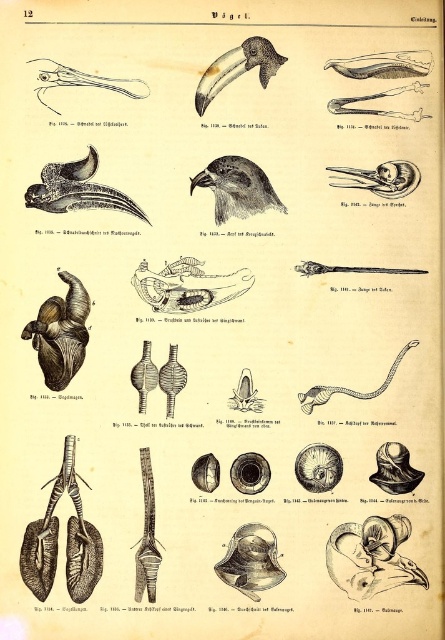
Question: Which of these objects is positioned farthest from the brown textured bird at center?

Choices:
 (A) bone-like skeleton at upper right
 (B) black glossy beak at upper center

Answer: (A)

Question: Which point is farther to the camera?

Choices:
 (A) smooth gray snake at center
 (B) matte black beak at upper left
 (C) brown textured bird at center
 (D) brown leather heart at center

Answer: (A)

Question: Is matte black beak at upper left thinner than smooth gray snake at center?

Choices:
 (A) yes
 (B) no

Answer: (A)

Question: Is matte black bird beak at upper left further to the viewer compared to matte black beak at upper left?

Choices:
 (A) no
 (B) yes

Answer: (B)

Question: Among these points, which one is nearest to the camera?

Choices:
 (A) (144, 92)
 (B) (257, 44)

Answer: (A)

Question: Is black glossy beak at upper center wider than matte black beak at upper left?

Choices:
 (A) yes
 (B) no

Answer: (B)